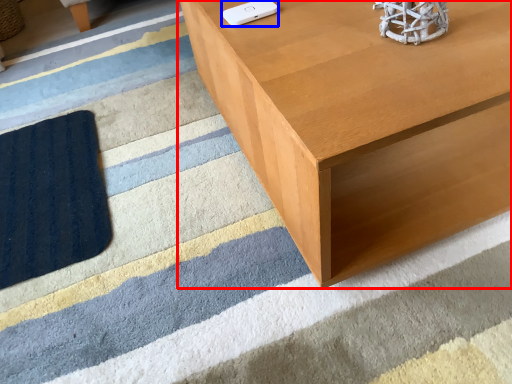
Question: Which point is closer to the camera, table (highlighted by a red box) or Wii controller (highlighted by a blue box)?

Choices:
 (A) table
 (B) Wii controller

Answer: (A)